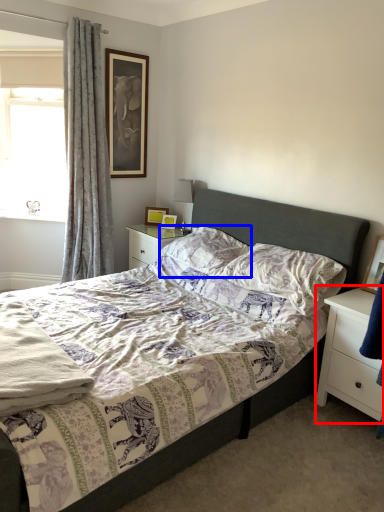
Question: Which of the following is the closest to the observer, nightstand (highlighted by a red box) or pillow (highlighted by a blue box)?

Choices:
 (A) nightstand
 (B) pillow

Answer: (A)